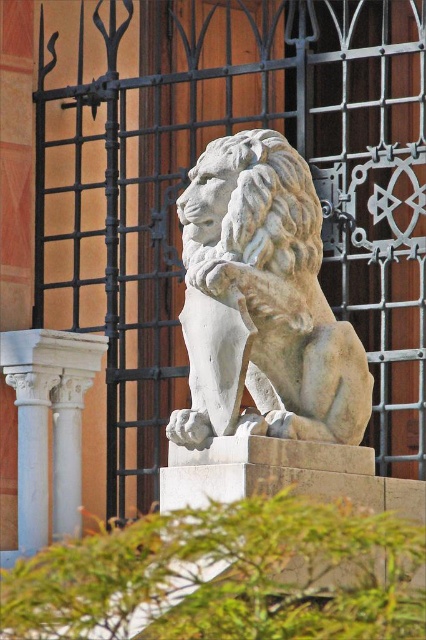
Can you confirm if white stone lion at center is positioned below white marble column at lower left?

Incorrect, white stone lion at center is not positioned below white marble column at lower left.

Is white stone lion at center further to the viewer compared to white marble column at lower left?

That is False.

Locate an element on the screen. white stone lion at center is located at coordinates (262, 301).